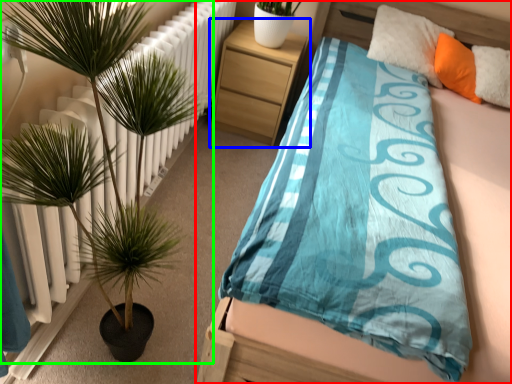
Question: Which object is positioned closest to bed (highlighted by a red box)? Select from nightstand (highlighted by a blue box) and houseplant (highlighted by a green box).

Choices:
 (A) nightstand
 (B) houseplant

Answer: (B)